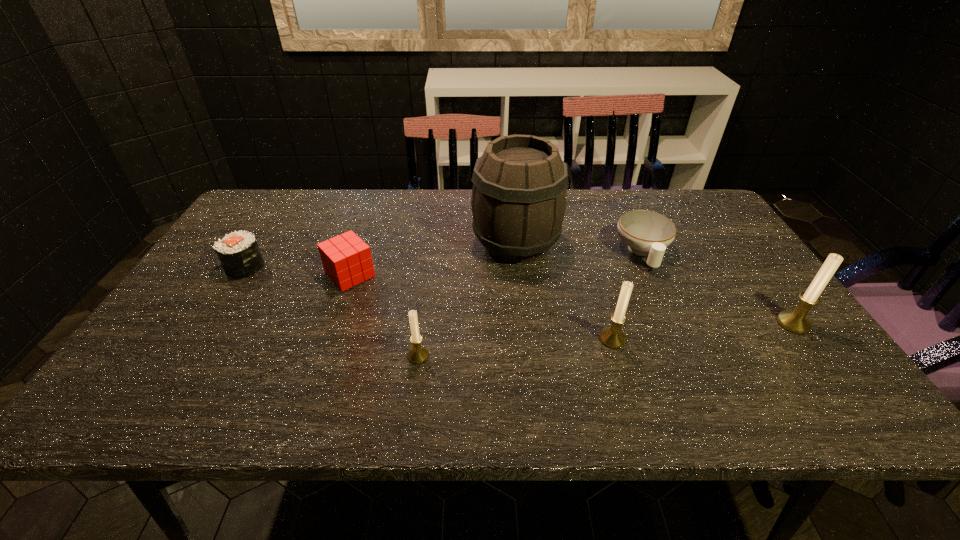
The width and height of the screenshot is (960, 540). Find the location of `object situated at the right edge`. object situated at the right edge is located at coordinates (795, 321).

Identify the location of free space at the far edge. pyautogui.click(x=330, y=211).

Find the location of a particular element. free location at the near edge of the desktop is located at coordinates (483, 357).

I want to click on vacant space at the right edge, so click(775, 306).

This screenshot has height=540, width=960. Find the location of `free space at the near left corner`. free space at the near left corner is located at coordinates (137, 353).

Where is `blank area at the far right corner`? blank area at the far right corner is located at coordinates (695, 218).

This screenshot has height=540, width=960. I want to click on vacant region between the wine bucket and the rightmost object, so click(655, 284).

At what (x,y) coordinates should I click in order to perform the action: click on vacant space that's between the sixth object from left to right and the sixth shortest object. Please return your answer as a coordinate pair (x, y). This screenshot has width=960, height=540. Looking at the image, I should click on (718, 288).

Locate an element on the screen. free space between the second object from right to left and the cube is located at coordinates (496, 264).

Locate an element on the screen. The image size is (960, 540). free area in between the second object from left to right and the shortest candle holder is located at coordinates (384, 315).